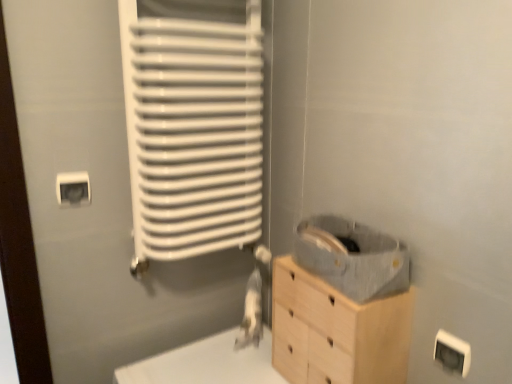
Question: Is white plastic electric outlet at upper left, acting as the first electric outlet starting from the back, inside the boundaries of light wood chest of drawers at lower right, or outside?

Choices:
 (A) outside
 (B) inside

Answer: (A)

Question: Considering the positions of white plastic electric outlet at upper left, the 2th electric outlet from the front, and light wood chest of drawers at lower right in the image, is white plastic electric outlet at upper left, the 2th electric outlet from the front, wider or thinner than light wood chest of drawers at lower right?

Choices:
 (A) wide
 (B) thin

Answer: (B)

Question: Which is nearer to the white plastic electric outlet at lower right, which ranks as the first electric outlet in bottom-to-top order?

Choices:
 (A) light wood chest of drawers at lower right
 (B) white plastic electric outlet at upper left, the first electric outlet positioned from the left
 (C) white matte radiator at left

Answer: (A)

Question: Considering the real-world distances, which object is farthest from the white matte radiator at left?

Choices:
 (A) white plastic electric outlet at upper left, the first electric outlet positioned from the left
 (B) white plastic electric outlet at lower right, which is the 1th electric outlet in right-to-left order
 (C) light wood chest of drawers at lower right

Answer: (B)